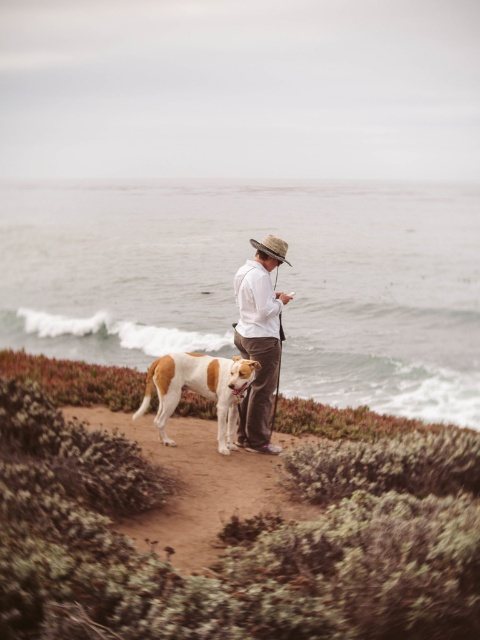
Question: Estimate the real-world distances between objects in this image. Which object is farther from the white and brown fur dog at center?

Choices:
 (A) brown dirt path at center
 (B) white cotton shirt at center
 (C) brown straw cowboy hat at center

Answer: (C)

Question: Which point is farther to the camera?

Choices:
 (A) white cotton shirt at center
 (B) brown straw cowboy hat at center
 (C) white and brown fur dog at center

Answer: (B)

Question: Which object is positioned farthest from the brown dirt path at center?

Choices:
 (A) white and brown fur dog at center
 (B) white cotton shirt at center

Answer: (B)

Question: Considering the relative positions of brown dirt path at center and white cotton shirt at center in the image provided, where is brown dirt path at center located with respect to white cotton shirt at center?

Choices:
 (A) above
 (B) below

Answer: (B)

Question: Does white cotton shirt at center come behind white and brown fur dog at center?

Choices:
 (A) no
 (B) yes

Answer: (B)

Question: Does brown dirt path at center have a lesser width compared to white cotton shirt at center?

Choices:
 (A) yes
 (B) no

Answer: (B)